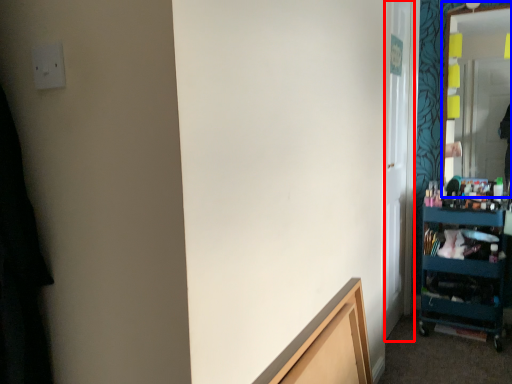
Question: Which of the following is the closest to the observer, glass door (highlighted by a red box) or mirror (highlighted by a blue box)?

Choices:
 (A) glass door
 (B) mirror

Answer: (A)